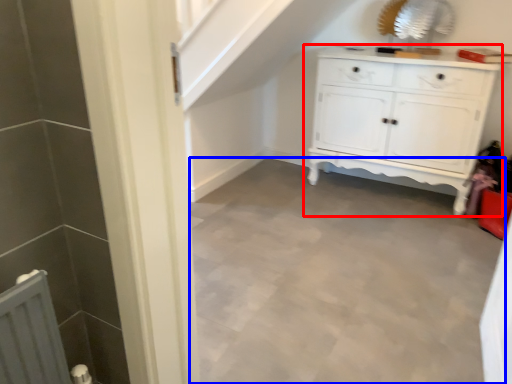
Question: Which object appears closest to the camera in this image, chest of drawers (highlighted by a red box) or plain (highlighted by a blue box)?

Choices:
 (A) chest of drawers
 (B) plain

Answer: (B)